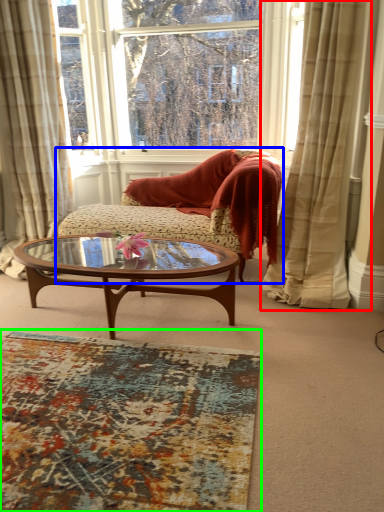
Question: Based on their relative distances, which object is farther from curtain (highlighted by a red box)? Choose from studio couch (highlighted by a blue box) and plain (highlighted by a green box).

Choices:
 (A) studio couch
 (B) plain

Answer: (B)